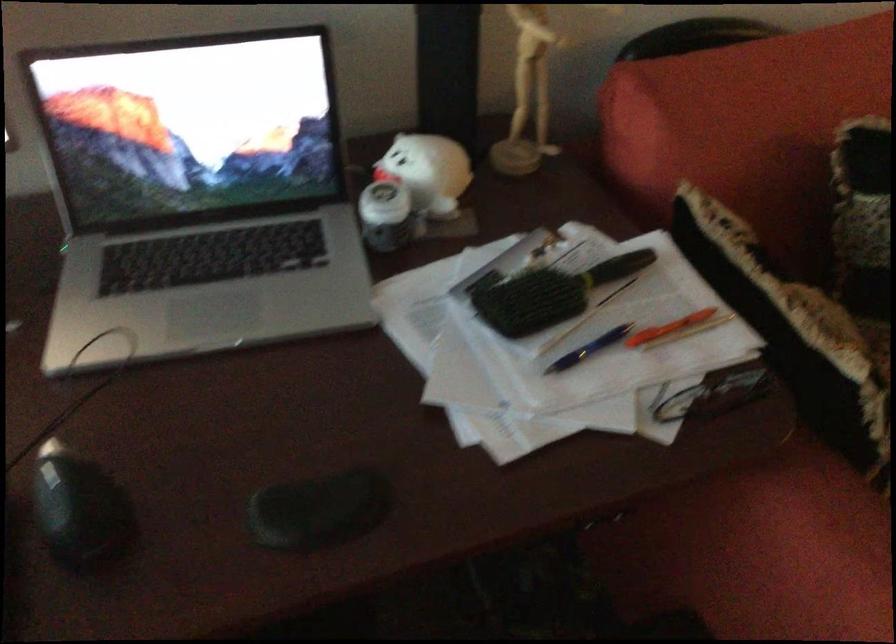
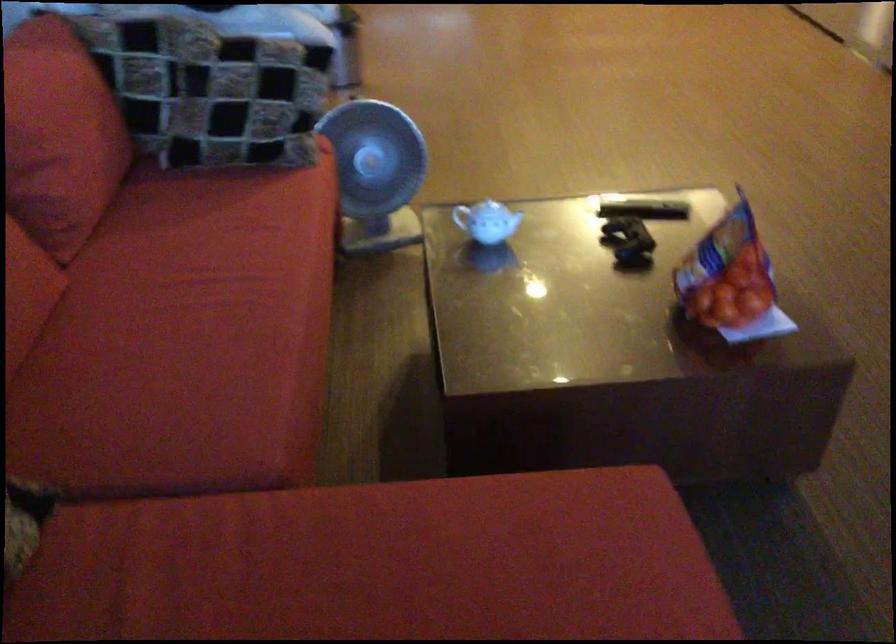
The images are taken continuously from a first-person perspective. In which direction is your viewpoint rotating?

The camera's rotation is toward right-down.